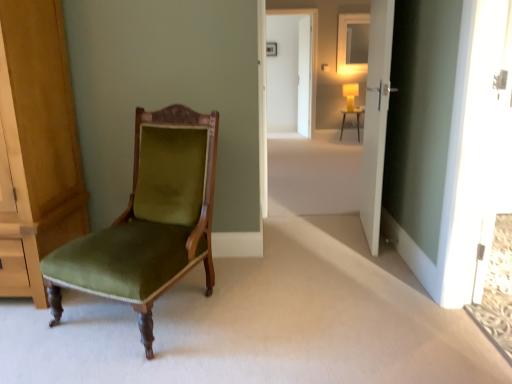
Identify the location of vacant space behind matte yellow lampshade at center. (308, 197).